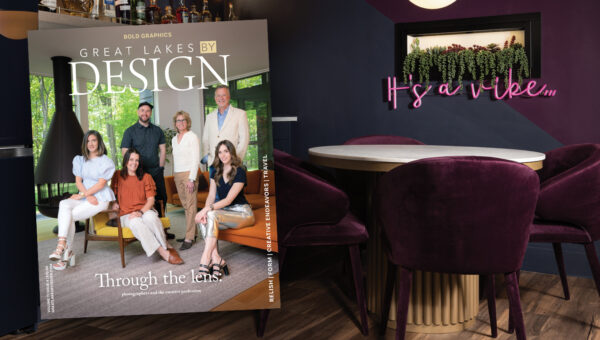
You are a GUI agent. You are given a task and a screenshot of the screen. Output one action in this format:
    pyautogui.click(x=<x>, y=<y>)
    Task: Click on the orange couch
    This screenshot has height=340, width=600.
    Given the screenshot: What is the action you would take?
    pyautogui.click(x=255, y=235)